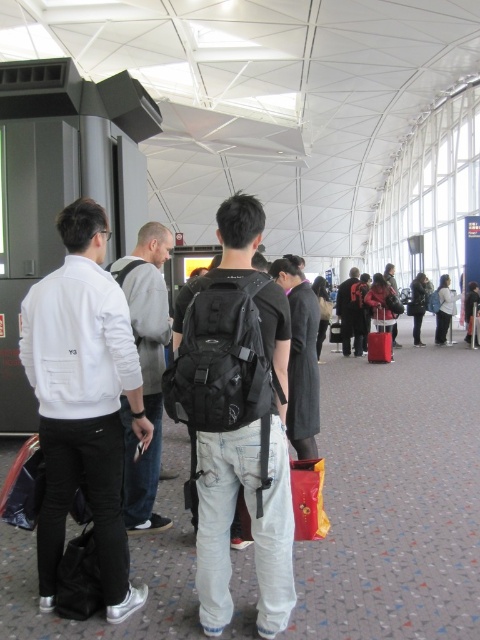
Measure the distance between point (51, 356) and camera.

They are 2.43 meters apart.

Does white matte jacket at left have a larger size compared to gray fabric backpack at center?

Incorrect, white matte jacket at left is not larger than gray fabric backpack at center.

Does point (96, 211) come closer to viewer compared to point (145, 397)?

Yes, point (96, 211) is closer to viewer.

Find the location of a particular element. white matte jacket at left is located at coordinates (84, 403).

Between gray fabric backpack at center and dark gray backpack at center, which one has less height?

Standing shorter between the two is dark gray backpack at center.

Which is more to the right, gray fabric backpack at center or dark gray backpack at center?

From the viewer's perspective, dark gray backpack at center appears more on the right side.

The height and width of the screenshot is (640, 480). Identify the location of gray fabric backpack at center. (145, 368).

Consider the image. Which of these two, white matte jacket at left or matte black backpack at center, stands taller?

Standing taller between the two is white matte jacket at left.

You are a GUI agent. You are given a task and a screenshot of the screen. Output one action in this format:
    pyautogui.click(x=<x>, y=<y>)
    Task: Click on the white matte jacket at left
    
    Given the screenshot: What is the action you would take?
    pyautogui.click(x=84, y=403)